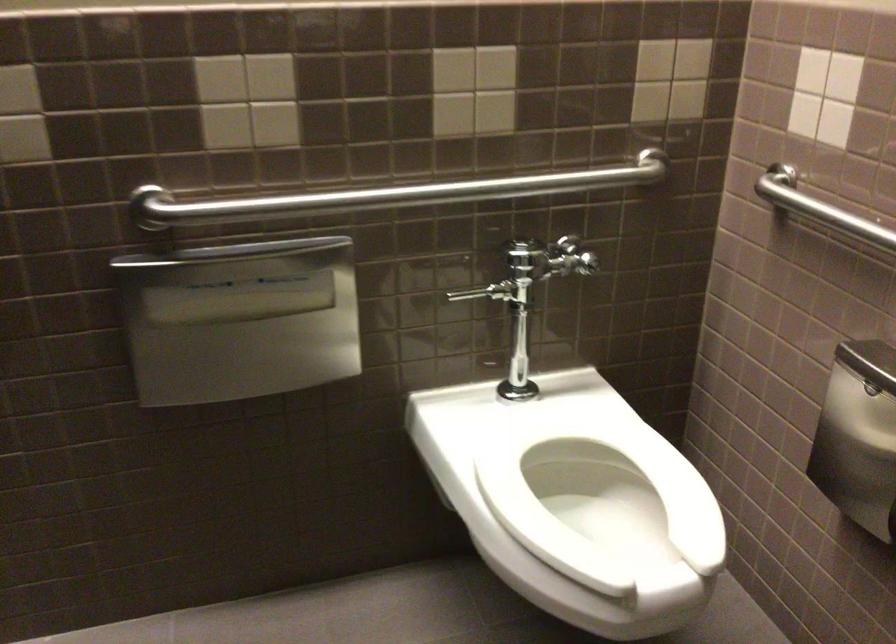
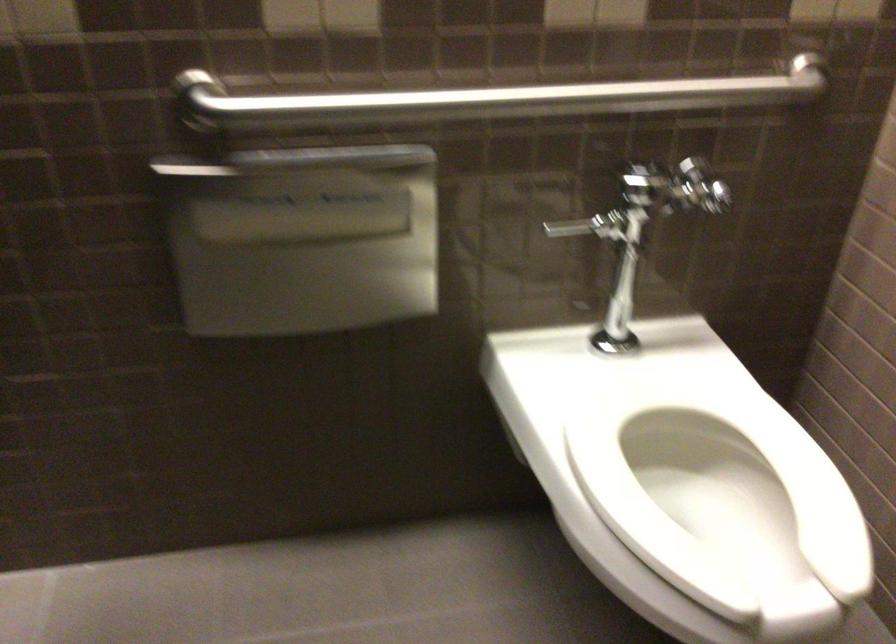
Locate, in the second image, the point that corresponds to point (392, 187) in the first image.

(488, 100)